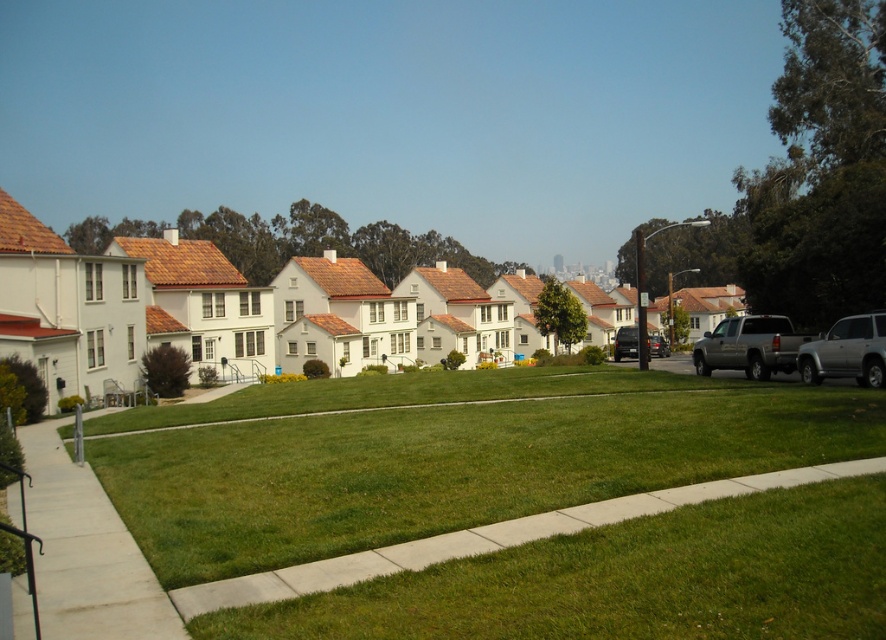
Can you confirm if green smooth lawn at center is thinner than silver metallic suv at right?

No, green smooth lawn at center is not thinner than silver metallic suv at right.

What do you see at coordinates (630, 579) in the screenshot? I see `green smooth lawn at center` at bounding box center [630, 579].

Find the location of a particular element. green smooth lawn at center is located at coordinates (630, 579).

Is green smooth lawn at center in front of silver metallic truck at right?

That is True.

Find the location of a particular element. The width and height of the screenshot is (886, 640). green smooth lawn at center is located at coordinates (630, 579).

The width and height of the screenshot is (886, 640). What do you see at coordinates (86, 552) in the screenshot?
I see `gray concrete sidewalk at lower left` at bounding box center [86, 552].

Can you confirm if gray concrete sidewalk at lower left is shorter than silver metallic truck at right?

Yes.

Is point (53, 426) less distant than point (719, 326)?

Yes, point (53, 426) is closer to viewer.

At what (x,y) coordinates should I click in order to perform the action: click on gray concrete sidewalk at lower left. Please return your answer as a coordinate pair (x, y). Image resolution: width=886 pixels, height=640 pixels. Looking at the image, I should click on (86, 552).